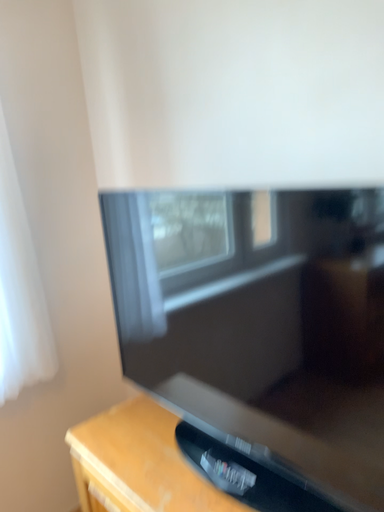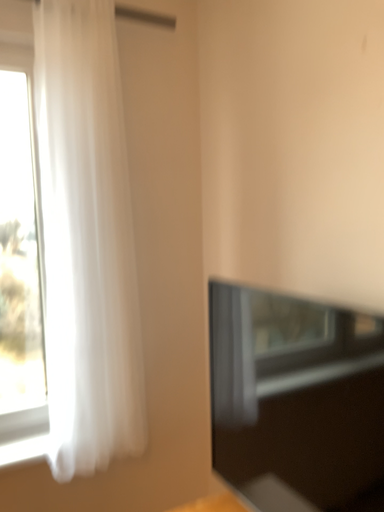
Question: Which way did the camera rotate in the video?

Choices:
 (A) rotated downward
 (B) rotated upward

Answer: (B)